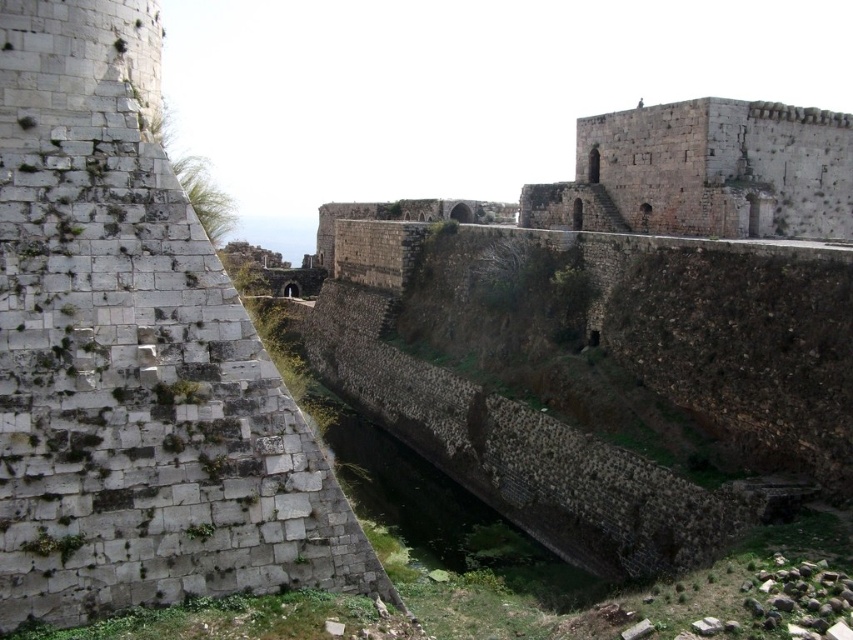
Is white stone wall at left to the right of gray stone tower at center from the viewer's perspective?

Incorrect, white stone wall at left is not on the right side of gray stone tower at center.

This screenshot has width=853, height=640. What do you see at coordinates (134, 356) in the screenshot? I see `white stone wall at left` at bounding box center [134, 356].

Does point (15, 273) come farther from viewer compared to point (648, 209)?

No.

Identify the location of white stone wall at left. Image resolution: width=853 pixels, height=640 pixels. (x=134, y=356).